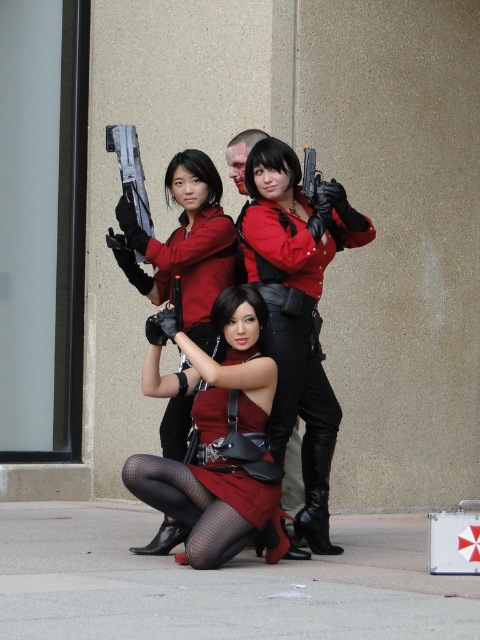
You are a photographer setting up a shoot with the three people in Resident Evil costumes. You need to ensure that the matte black gun at center and the matte red dress at center are visible in the frame. Based on their positions, which object is higher up in the image?

The matte black gun at center is located above the matte red dress at center, so the matte black gun at center is higher up in the image.

You are a photographer at the scene. You want to capture a photo where the matte red dress at center is in focus while keeping the matte black gun at center slightly blurred in the background. Is this possible given their positions?

The matte red dress at center is behind the matte black gun at center, so positioning the camera to focus on the matte red dress at center would naturally place the matte black gun at center in the background, resulting in a blurred effect for the gun.

Consider the image. You are a photographer at the scene. You want to take a photo that includes both the matte black gun at center and the matte red dress at center. Which object should be placed to the right side of the frame to ensure both are visible?

The matte black gun at center is to the right of the matte red dress at center. To include both in the photo, position the matte black gun at center on the right side of the frame so that the matte red dress at center is on the left, ensuring both are visible.